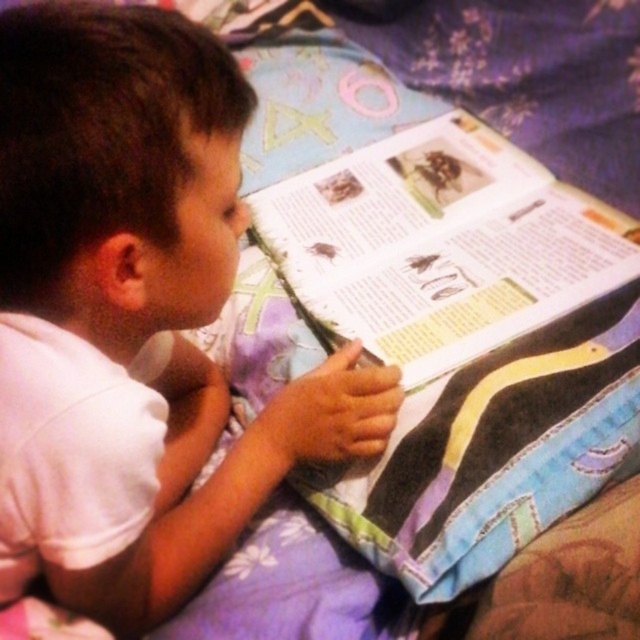
Question: Which object is farther from the camera taking this photo?

Choices:
 (A) paperback book at center
 (B) white matte shirt at upper left

Answer: (A)

Question: Does white matte shirt at upper left have a smaller size compared to paperback book at center?

Choices:
 (A) no
 (B) yes

Answer: (B)

Question: Which object is farther from the camera taking this photo?

Choices:
 (A) paperback book at center
 (B) white matte shirt at upper left

Answer: (A)

Question: Is white matte shirt at upper left thinner than paperback book at center?

Choices:
 (A) yes
 (B) no

Answer: (A)

Question: Does white matte shirt at upper left have a greater width compared to paperback book at center?

Choices:
 (A) yes
 (B) no

Answer: (B)

Question: Which object is farther from the camera taking this photo?

Choices:
 (A) paperback book at center
 (B) white matte shirt at upper left

Answer: (A)